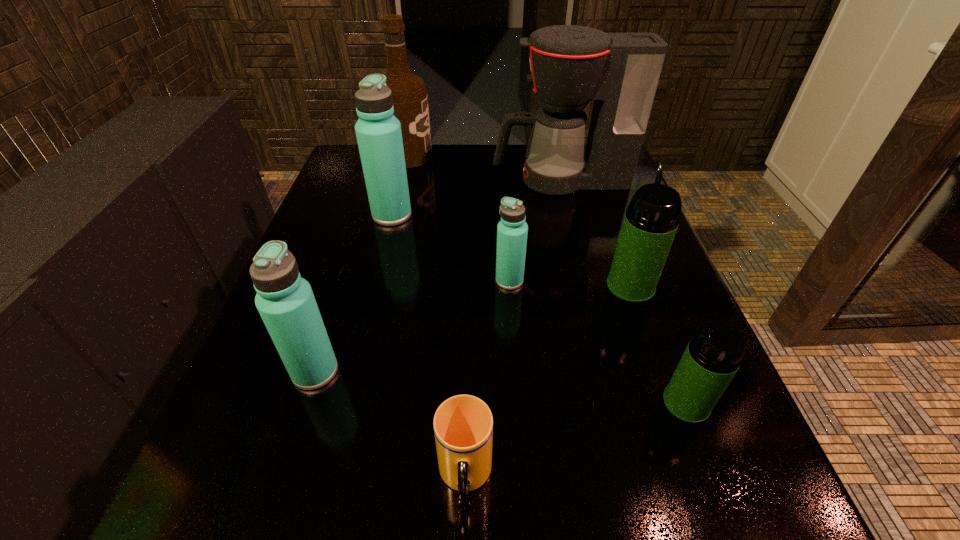
Where is `vacant region located on the left of the smallest aqua thermos bottle`? The height and width of the screenshot is (540, 960). vacant region located on the left of the smallest aqua thermos bottle is located at coordinates (339, 280).

Image resolution: width=960 pixels, height=540 pixels. What are the coordinates of `vacant area situated from the spout of the nearer green thermos bottle` in the screenshot? It's located at (603, 403).

At what (x,y) coordinates should I click in order to perform the action: click on free space located 0.270m from the spout of the nearer green thermos bottle. Please return your answer as a coordinate pair (x, y). Image resolution: width=960 pixels, height=540 pixels. Looking at the image, I should click on (482, 403).

Find the location of a particular element. The height and width of the screenshot is (540, 960). vacant space located from the spout of the nearer green thermos bottle is located at coordinates [414, 403].

Locate an element on the screen. alcohol located in the far edge section of the desktop is located at coordinates (410, 100).

At what (x,y) coordinates should I click in order to perform the action: click on coffee maker that is at the far edge. Please return your answer as a coordinate pair (x, y). Looking at the image, I should click on (571, 65).

Find the location of `object at the near edge`. object at the near edge is located at coordinates (463, 425).

You are a GUI agent. You are given a task and a screenshot of the screen. Output one action in this format:
    pyautogui.click(x=<x>, y=<y>)
    Task: Click on the alcohol present at the left edge
    This screenshot has width=960, height=540.
    Given the screenshot: What is the action you would take?
    pyautogui.click(x=410, y=100)

The height and width of the screenshot is (540, 960). In order to click on coffee maker located at the right edge in this screenshot , I will do `click(571, 65)`.

Identify the location of object present at the far left corner. (410, 100).